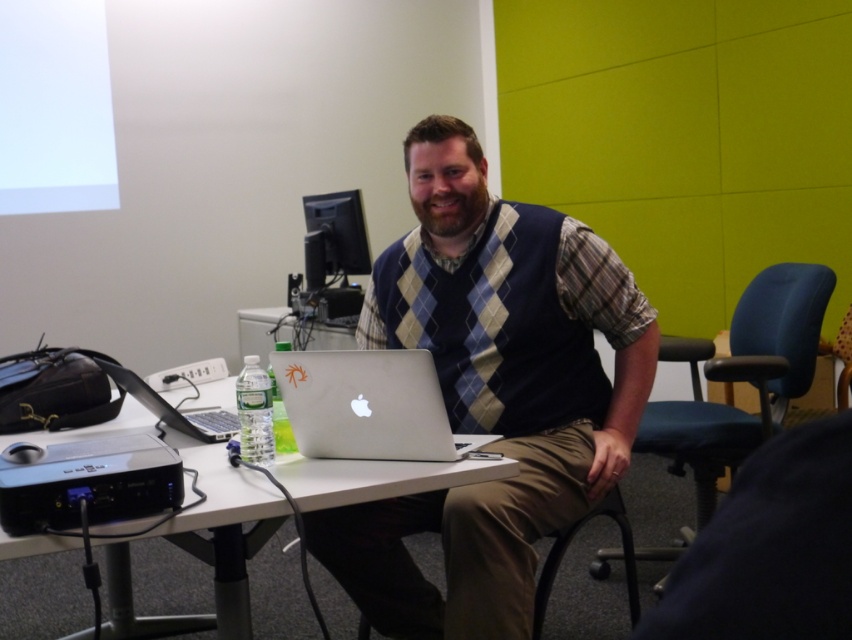
Question: Is dark blue fabric at lower right to the right of black glossy monitor at upper center from the viewer's perspective?

Choices:
 (A) no
 (B) yes

Answer: (B)

Question: Can you confirm if dark blue fabric at lower right is bigger than black glossy monitor at upper center?

Choices:
 (A) no
 (B) yes

Answer: (A)

Question: Which object appears farthest from the camera in this image?

Choices:
 (A) blue fabric swivel chair at right
 (B) white plastic table at center

Answer: (A)

Question: Can you confirm if blue fabric swivel chair at right is positioned to the right of black plastic projector at lower left?

Choices:
 (A) yes
 (B) no

Answer: (A)

Question: Which object is closer to the camera taking this photo?

Choices:
 (A) blue fabric swivel chair at right
 (B) dark blue fabric at lower right

Answer: (B)

Question: Which object is closer to the camera taking this photo?

Choices:
 (A) dark blue fabric at lower right
 (B) black glossy monitor at upper center
 (C) silver metallic laptop at center

Answer: (A)